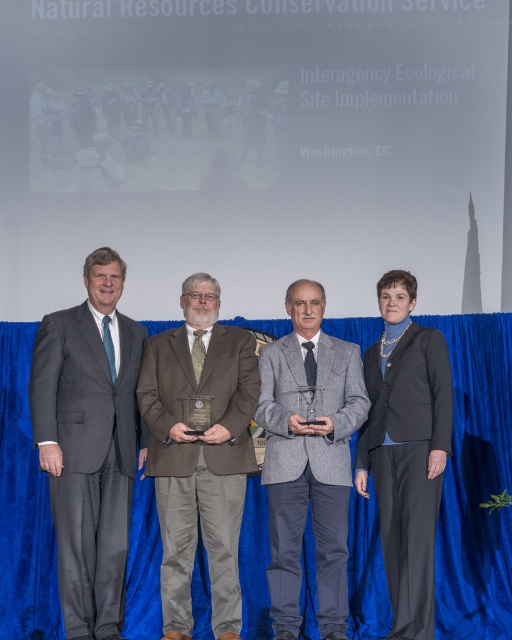
You are a photographer at this event and need to adjust the camera focus. Since the brown woolen suit at center and the gray wool suit at center are both in the frame, which one should you focus on first if you want to ensure the taller person is in focus?

The brown woolen suit at center is taller than the gray wool suit at center, so you should focus on the brown woolen suit at center first to ensure the taller person is in focus.

You are an event photographer standing at the back of the stage. You want to take a photo of the brown woolen suit at center and the gray wool suit at center. The minimum distance your camera can focus on two objects is 40 centimeters. Can you capture both subjects clearly in the same frame?

The brown woolen suit at center is 41.71 centimeters away from gray wool suit at center. Since the distance between them is greater than the minimum focus distance of 40 centimeters, your camera can capture both subjects clearly in the same frame.